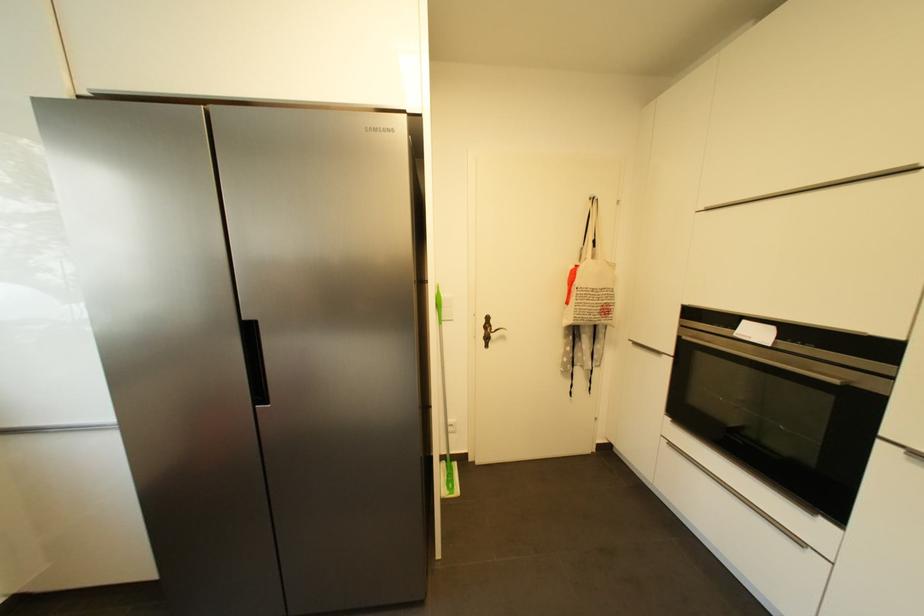
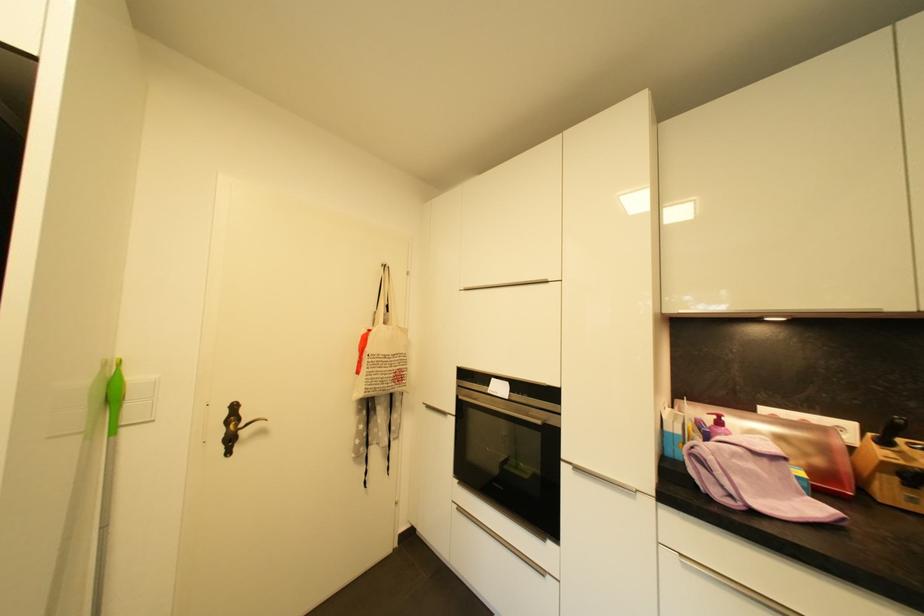
Where in the second image is the point corresponding to pixel 442 307 from the first image?

(116, 400)